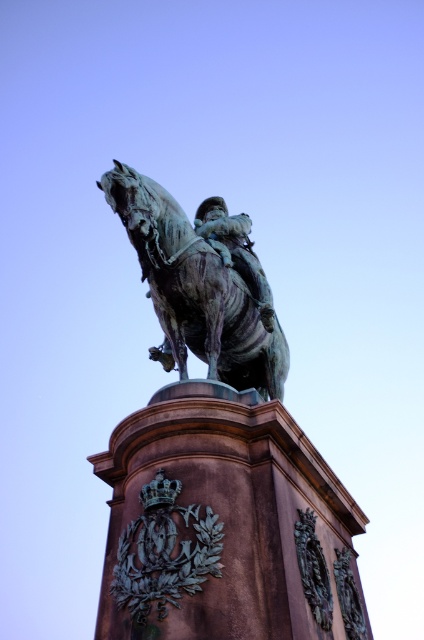
Does point (167, 298) come in front of point (128, 564)?

No.

Is bronze/greenish patina horse at center further to camera compared to bronze emblem at center?

Yes, bronze/greenish patina horse at center is further from the viewer.

This screenshot has height=640, width=424. What do you see at coordinates (195, 291) in the screenshot?
I see `bronze/greenish patina horse at center` at bounding box center [195, 291].

Find the location of `bronze/greenish patina horse at center`. bronze/greenish patina horse at center is located at coordinates (195, 291).